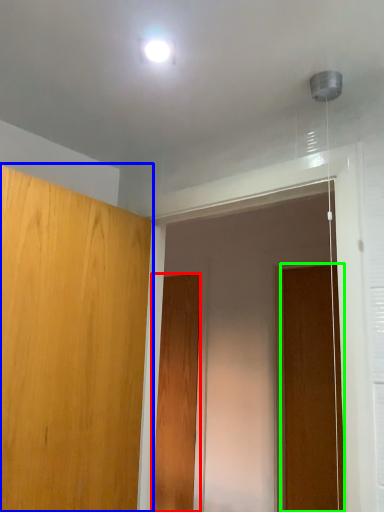
Question: Based on their relative distances, which object is nearer to door (highlighted by a red box)? Choose from door (highlighted by a blue box) and door (highlighted by a green box).

Choices:
 (A) door
 (B) door

Answer: (B)